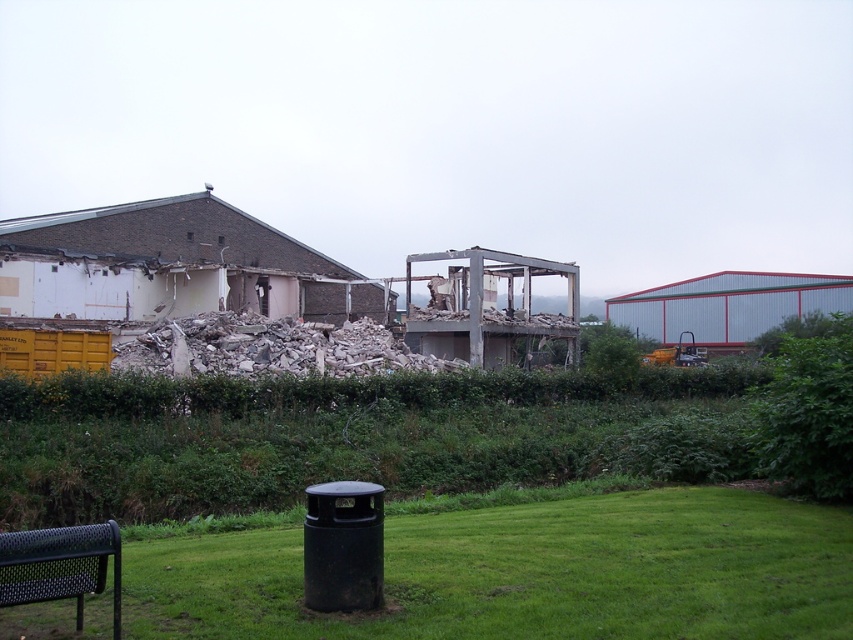
You are a gardener who needs to move a heavy potted plant from the green grass at lower center to the black mesh park bench at lower left. Based on their positions, can you place the potted plant on the bench without moving it far?

The green grass at lower center is located below the black mesh park bench at lower left, so the potted plant can be placed on the bench by moving it upward since the bench is above the grass.

You are standing at the center of the image. Based on the coordinates provided, is the green grass at lower center located to your left or right side?

The green grass at lower center is located at coordinates point (x=527, y=573), which places it to your right side.

You are planning to place a new bench in the park. The existing black mesh park bench at lower left is narrower than the green leafy hedge at lower right. Which object should you consider for space availability when placing the new bench?

The black mesh park bench at lower left is narrower than the green leafy hedge at lower right, so you should consider placing the new bench near the black mesh park bench at lower left as it has more space available.